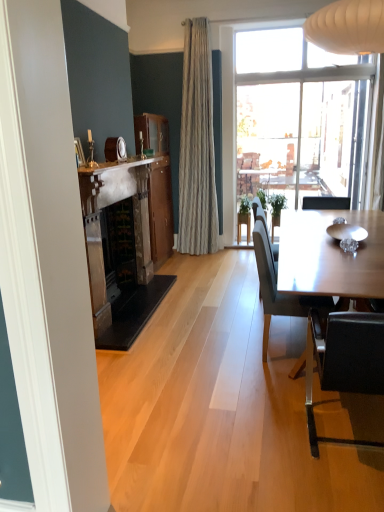
You are a GUI agent. You are given a task and a screenshot of the screen. Output one action in this format:
    pyautogui.click(x=<x>, y=<y>)
    Task: Click on the white marble fireplace at upper center
    Image resolution: width=384 pixels, height=512 pixels.
    Given the screenshot: What is the action you would take?
    pyautogui.click(x=122, y=164)

This screenshot has height=512, width=384. What do you see at coordinates (344, 361) in the screenshot?
I see `black leather chair at lower right, acting as the 1th chair starting from the front` at bounding box center [344, 361].

At what (x,y) coordinates should I click in order to perform the action: click on white marble fireplace at upper center. Please return your answer as a coordinate pair (x, y). The width and height of the screenshot is (384, 512). Looking at the image, I should click on (122, 164).

Is wooden picture frame at upper left thinner than green matte plant at center?

Yes, wooden picture frame at upper left is thinner than green matte plant at center.

Is wooden picture frame at upper left aimed at green matte plant at center?

No.

I want to click on picture frame that is on the left side of green matte plant at center, so click(x=79, y=152).

Which is in front, point (80, 148) or point (250, 220)?

The point (80, 148) is closer.

Which object is positioned more to the left, green matte plant at center or wooden picture frame at upper left?

Positioned to the left is wooden picture frame at upper left.

Considering the positions of point (237, 214) and point (77, 162), is point (237, 214) closer or farther from the camera than point (77, 162)?

Point (237, 214).

How many degrees apart are the facing directions of green matte plant at center and wooden picture frame at upper left?

The angle between the facing direction of green matte plant at center and the facing direction of wooden picture frame at upper left is 93.5 degrees.

Is point (316, 298) positioned before point (242, 202)?

Yes, it is.

Is dark gray fabric chair at right, positioned as the 1th chair in back-to-front order, situated inside green matte plant at center or outside?

dark gray fabric chair at right, positioned as the 1th chair in back-to-front order, is spatially situated outside green matte plant at center.

Is dark gray fabric chair at right, positioned as the 1th chair in back-to-front order, in contact with green matte plant at center?

No.

From the image's perspective, which one is positioned higher, dark gray fabric chair at right, positioned as the 1th chair in back-to-front order, or green matte plant at center?

green matte plant at center is shown above in the image.

What are the coordinates of `cabinetry located above the green matte plant at center (from a real-world perspective)` in the screenshot? It's located at (157, 184).

From the image's perspective, between mahogany wood cabinet at center and green matte plant at center, which one is located above?

mahogany wood cabinet at center.

Considering the points (150, 177) and (249, 233), which point is in front, point (150, 177) or point (249, 233)?

The point (150, 177) is closer to the camera.

At what (x,y) coordinates should I click in order to perform the action: click on chair that is behind the black leather chair at lower right, acting as the 1th chair starting from the front. Please return your answer as a coordinate pair (x, y). Looking at the image, I should click on (280, 292).

Is black leather chair at lower right, acting as the 1th chair starting from the front, taller than dark gray fabric chair at right, marked as the 2th chair in a front-to-back arrangement?

In fact, black leather chair at lower right, acting as the 1th chair starting from the front, may be shorter than dark gray fabric chair at right, marked as the 2th chair in a front-to-back arrangement.

How many degrees apart are the facing directions of black leather chair at lower right, acting as the 1th chair starting from the front, and dark gray fabric chair at right, positioned as the 1th chair in back-to-front order?

Result: There is a 90-degree angle between the facing directions of black leather chair at lower right, acting as the 1th chair starting from the front, and dark gray fabric chair at right, positioned as the 1th chair in back-to-front order.

Is black leather chair at lower right, which appears as the second chair when viewed from the back, with dark gray fabric chair at right, positioned as the 1th chair in back-to-front order?

There is a gap between black leather chair at lower right, which appears as the second chair when viewed from the back, and dark gray fabric chair at right, positioned as the 1th chair in back-to-front order.

From a real-world perspective, is white marble fireplace at upper center on black leather chair at lower right, which appears as the second chair when viewed from the back?

Correct, in the physical world, white marble fireplace at upper center is higher than black leather chair at lower right, which appears as the second chair when viewed from the back.

Considering the positions of objects white marble fireplace at upper center and black leather chair at lower right, which appears as the second chair when viewed from the back, in the image provided, who is more to the left, white marble fireplace at upper center or black leather chair at lower right, which appears as the second chair when viewed from the back,?

Positioned to the left is white marble fireplace at upper center.

Who is more distant, white marble fireplace at upper center or black leather chair at lower right, which appears as the second chair when viewed from the back?

white marble fireplace at upper center is further away from the camera.

Is white marble fireplace at upper center shorter than black leather chair at lower right, which appears as the second chair when viewed from the back?

Yes.

From the image's perspective, would you say dark gray fabric chair at right, positioned as the 1th chair in back-to-front order, is positioned over mahogany wood cabinet at center?

Incorrect, from the image's perspective, dark gray fabric chair at right, positioned as the 1th chair in back-to-front order, is lower than mahogany wood cabinet at center.

Is dark gray fabric chair at right, marked as the 2th chair in a front-to-back arrangement, facing towards mahogany wood cabinet at center?

No, dark gray fabric chair at right, marked as the 2th chair in a front-to-back arrangement, is not aimed at mahogany wood cabinet at center.

Is dark gray fabric chair at right, positioned as the 1th chair in back-to-front order, wider or thinner than mahogany wood cabinet at center?

dark gray fabric chair at right, positioned as the 1th chair in back-to-front order, is wider than mahogany wood cabinet at center.

Where is `houseplant behind the wooden picture frame at upper left`? This screenshot has width=384, height=512. houseplant behind the wooden picture frame at upper left is located at coordinates (244, 218).

Identify the location of houseplant below the wooden picture frame at upper left (from the image's perspective). (244, 218).

Looking at the image, which one is located further to mahogany wood cabinet at center, green matte plant at center or dark gray fabric chair at right, positioned as the 1th chair in back-to-front order?

dark gray fabric chair at right, positioned as the 1th chair in back-to-front order, is further to mahogany wood cabinet at center.

Estimate the real-world distances between objects in this image. Which object is closer to mahogany wood cabinet at center, black leather chair at lower right, which appears as the second chair when viewed from the back, or green matte plant at center?

green matte plant at center.

Based on their spatial positions, is dark gray fabric chair at right, marked as the 2th chair in a front-to-back arrangement, or wooden picture frame at upper left further from green matte plant at center?

wooden picture frame at upper left is positioned further to the anchor green matte plant at center.

Estimate the real-world distances between objects in this image. Which object is further from wooden picture frame at upper left, green matte plant at center or dark gray fabric chair at right, positioned as the 1th chair in back-to-front order?

green matte plant at center.

Looking at the image, which one is located closer to wooden picture frame at upper left, mahogany wood cabinet at center or dark gray fabric chair at right, marked as the 2th chair in a front-to-back arrangement?

dark gray fabric chair at right, marked as the 2th chair in a front-to-back arrangement, lies closer to wooden picture frame at upper left than the other object.

Considering their positions, is green matte plant at center positioned further to black leather chair at lower right, acting as the 1th chair starting from the front, than mahogany wood cabinet at center?

green matte plant at center is further to black leather chair at lower right, acting as the 1th chair starting from the front.

Looking at this image, from the image, which object appears to be nearer to wooden picture frame at upper left, black leather chair at lower right, which appears as the second chair when viewed from the back, or green matte plant at center?

The object closer to wooden picture frame at upper left is black leather chair at lower right, which appears as the second chair when viewed from the back.

Which object lies further to the anchor point mahogany wood cabinet at center, wooden picture frame at upper left or green matte plant at center?

wooden picture frame at upper left is further to mahogany wood cabinet at center.

The height and width of the screenshot is (512, 384). Identify the location of mantle located between black leather chair at lower right, which appears as the second chair when viewed from the back, and green matte plant at center in the depth direction. (122, 164).

The width and height of the screenshot is (384, 512). I want to click on picture frame between dark gray fabric chair at right, marked as the 2th chair in a front-to-back arrangement, and mahogany wood cabinet at center in the front-back direction, so click(x=79, y=152).

Identify the location of mantle between dark gray fabric chair at right, marked as the 2th chair in a front-to-back arrangement, and mahogany wood cabinet at center from front to back. (122, 164).

At what (x,y) coordinates should I click in order to perform the action: click on chair positioned between black leather chair at lower right, acting as the 1th chair starting from the front, and mahogany wood cabinet at center from near to far. Please return your answer as a coordinate pair (x, y). The height and width of the screenshot is (512, 384). Looking at the image, I should click on (280, 292).